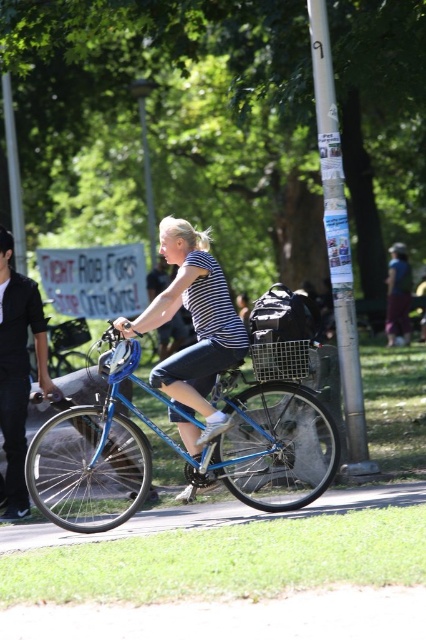
Who is higher up, striped fabric shirt at center or matte blue helmet at center?

Positioned higher is striped fabric shirt at center.

Is point (236, 321) behind point (98, 360)?

No, it is in front of (98, 360).

This screenshot has height=640, width=426. What are the coordinates of `striped fabric shirt at center` in the screenshot? It's located at (195, 330).

Locate an element on the screen. This screenshot has height=640, width=426. striped fabric shirt at center is located at coordinates (195, 330).

Is shiny blue bicycle at center to the right of striped fabric shirt at center from the viewer's perspective?

No, shiny blue bicycle at center is not to the right of striped fabric shirt at center.

Between shiny blue bicycle at center and striped fabric shirt at center, which one has less height?

shiny blue bicycle at center is shorter.

Describe the element at coordinates (92, 464) in the screenshot. I see `shiny blue bicycle at center` at that location.

The width and height of the screenshot is (426, 640). What are the coordinates of `shiny blue bicycle at center` in the screenshot? It's located at (92, 464).

Does black cotton shirt at left have a larger size compared to matte blue helmet at center?

Correct, black cotton shirt at left is larger in size than matte blue helmet at center.

Can you confirm if black cotton shirt at left is positioned above matte blue helmet at center?

No.

Is point (23, 344) in front of point (121, 346)?

No, (23, 344) is further to viewer.

Locate an element on the screen. This screenshot has width=426, height=640. black cotton shirt at left is located at coordinates (17, 372).